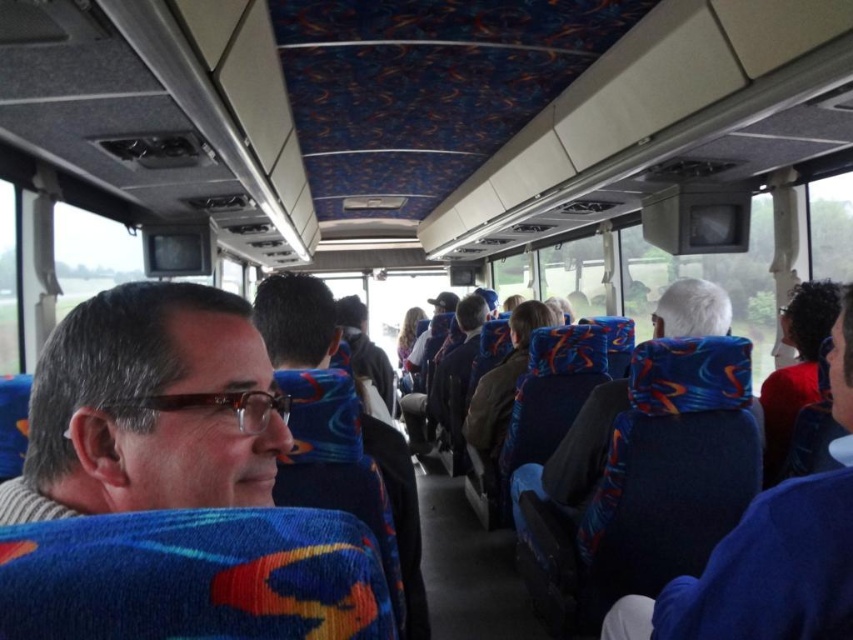
Is matte black glasses at left thinner than blue fabric headrest at right?

Indeed, matte black glasses at left has a lesser width compared to blue fabric headrest at right.

Is matte black glasses at left to the left of blue fabric headrest at right from the viewer's perspective?

Correct, you'll find matte black glasses at left to the left of blue fabric headrest at right.

Between point (99, 323) and point (730, 618), which one is positioned in front?

Point (99, 323)

Locate an element on the screen. This screenshot has width=853, height=640. matte black glasses at left is located at coordinates (149, 406).

Between point (258, 419) and point (390, 593), which one is positioned in front?

Positioned in front is point (258, 419).

Is matte black glasses at left to the right of matte blue jacket at center from the viewer's perspective?

No, matte black glasses at left is not to the right of matte blue jacket at center.

Identify the location of matte black glasses at left. (149, 406).

What do you see at coordinates (761, 573) in the screenshot? I see `blue fabric headrest at right` at bounding box center [761, 573].

Does blue fabric headrest at right appear under matte blue jacket at center?

Correct, blue fabric headrest at right is located below matte blue jacket at center.

Image resolution: width=853 pixels, height=640 pixels. I want to click on blue fabric headrest at right, so tap(761, 573).